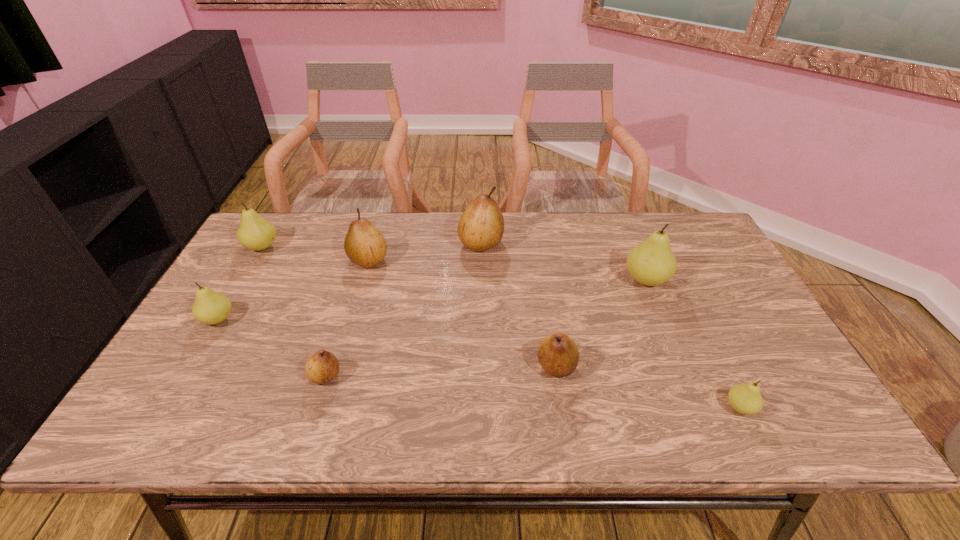
The image size is (960, 540). I want to click on the fifth object from left to right, so click(481, 226).

Where is `the fifth pear from left to right`? the fifth pear from left to right is located at coordinates (481, 226).

Find the location of a particular element. the third nearest green pear is located at coordinates (651, 262).

Locate an element on the screen. Image resolution: width=960 pixels, height=540 pixels. the second biggest green pear is located at coordinates (255, 233).

Locate an element on the screen. The height and width of the screenshot is (540, 960). the third smallest brown pear is located at coordinates (365, 245).

In order to click on the third object from right to left in this screenshot , I will do `click(558, 354)`.

Image resolution: width=960 pixels, height=540 pixels. What are the coordinates of `the second smallest brown pear` in the screenshot? It's located at (558, 354).

This screenshot has height=540, width=960. I want to click on the third biggest green pear, so click(210, 307).

Where is `the second nearest green pear`? The image size is (960, 540). the second nearest green pear is located at coordinates (210, 307).

This screenshot has width=960, height=540. I want to click on the smallest brown pear, so [322, 367].